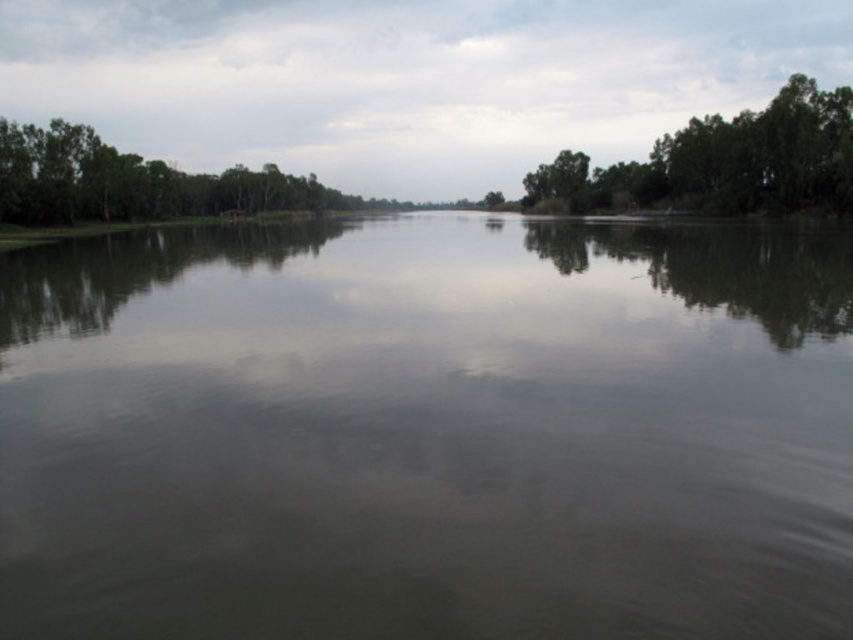
Between green leafy trees at right and green leafy trees at left, which one has less height?

With less height is green leafy trees at left.

Can you confirm if green leafy trees at right is thinner than green leafy trees at left?

Yes, green leafy trees at right is thinner than green leafy trees at left.

Who is more forward, (720, 196) or (103, 170)?

Point (720, 196) is more forward.

This screenshot has height=640, width=853. I want to click on green leafy trees at right, so click(724, 161).

In the scene shown: Can you confirm if green reflective water at center is positioned below green leafy trees at right?

Correct, green reflective water at center is located below green leafy trees at right.

Who is higher up, green reflective water at center or green leafy trees at right?

green leafy trees at right is higher up.

Does point (849, 237) come behind point (808, 102)?

That is False.

I want to click on green reflective water at center, so click(x=428, y=432).

Does point (438, 627) come closer to viewer compared to point (160, 216)?

Yes, point (438, 627) is in front of point (160, 216).

At what (x,y) coordinates should I click in order to perform the action: click on green reflective water at center. Please return your answer as a coordinate pair (x, y). Looking at the image, I should click on (428, 432).

Where is `green reflective water at center`? green reflective water at center is located at coordinates (428, 432).